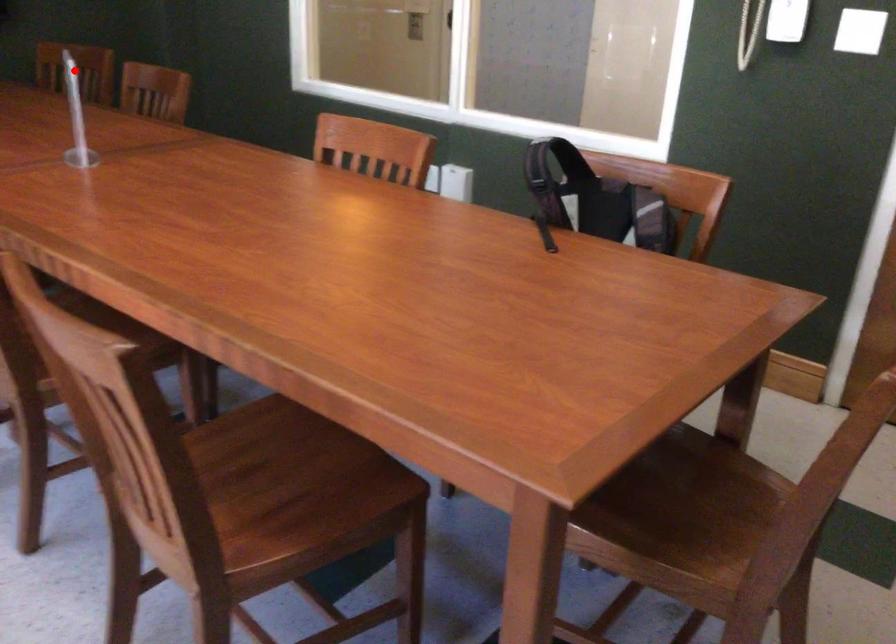
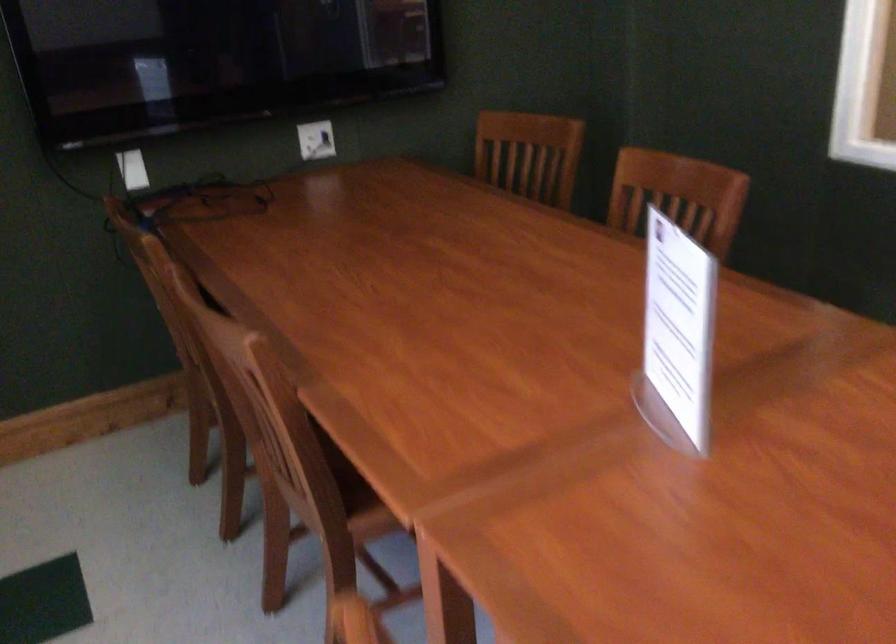
In the second image, find the point that corresponds to the highlighted location in the first image.

(529, 154)